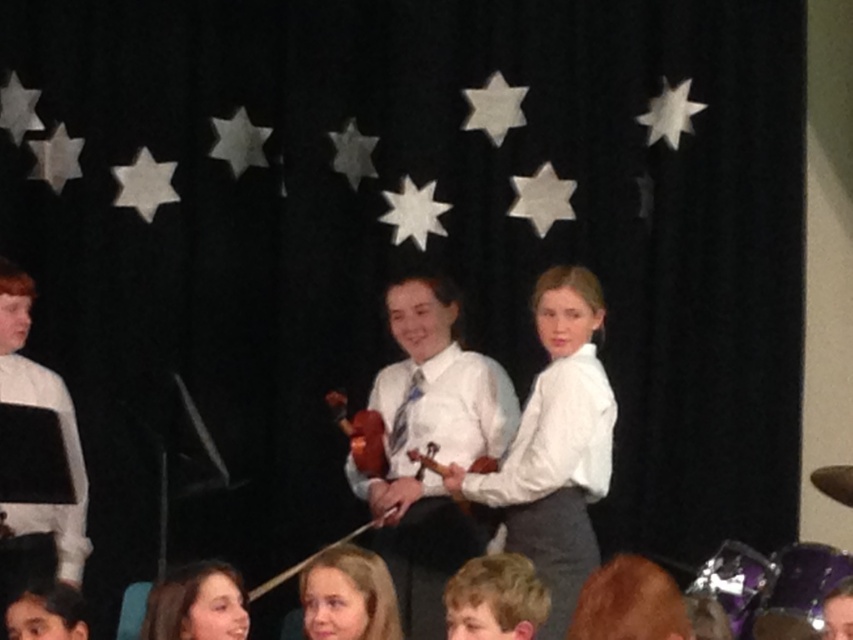
This screenshot has height=640, width=853. Find the location of `white satin blouse at center`. white satin blouse at center is located at coordinates (555, 445).

Is the position of white satin blouse at center less distant than that of wooden violin at center?

Yes.

Between point (547, 285) and point (357, 460), which one is positioned in front?

Point (547, 285)

The height and width of the screenshot is (640, 853). I want to click on white satin blouse at center, so click(x=555, y=445).

Which is above, smooth blonde hair at lower center or shiny black hair at center?

Positioned higher is shiny black hair at center.

Is point (335, 625) positioned behind point (840, 579)?

No.

Is point (329, 614) positioned in front of point (833, 596)?

No, (329, 614) is behind (833, 596).

This screenshot has height=640, width=853. I want to click on smooth blonde hair at lower center, so click(347, 596).

Is point (59, 566) positioned in front of point (312, 570)?

No, it is behind (312, 570).

Measure the distance between point (68, 468) and camera.

The distance of point (68, 468) from camera is 5.03 meters.

What do you see at coordinates (65, 451) in the screenshot?
I see `white striped shirt at left` at bounding box center [65, 451].

The height and width of the screenshot is (640, 853). What are the coordinates of `white striped shirt at left` in the screenshot? It's located at (65, 451).